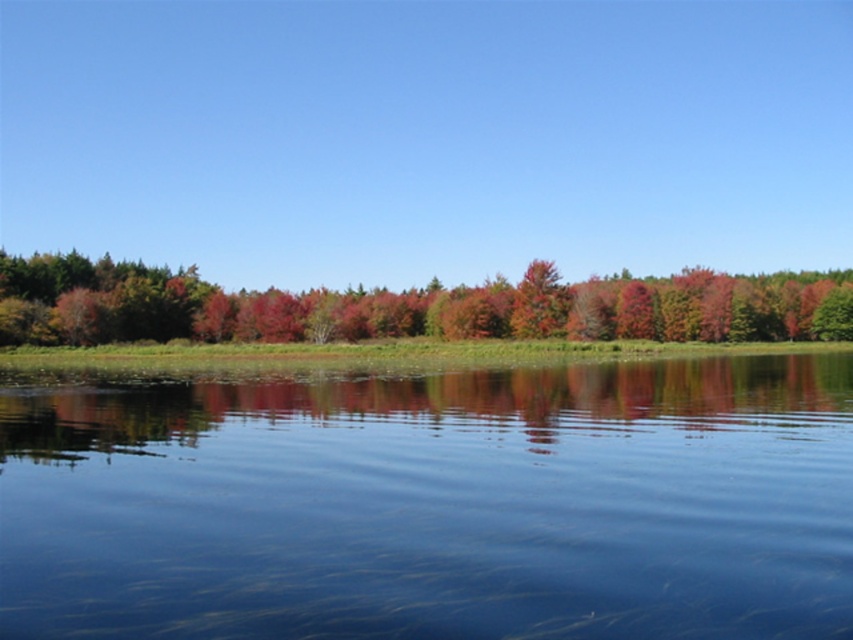
Question: Can you confirm if green matte tree at center is positioned above shiny red tree at center?

Choices:
 (A) yes
 (B) no

Answer: (B)

Question: Which object appears closest to the camera in this image?

Choices:
 (A) transparent water at center
 (B) shiny red tree at center

Answer: (A)

Question: Is transparent water at center thinner than shiny red tree at center?

Choices:
 (A) yes
 (B) no

Answer: (B)

Question: Which object is positioned closest to the green matte tree at center?

Choices:
 (A) shiny red tree at center
 (B) transparent water at center

Answer: (A)

Question: Which object is closer to the camera taking this photo?

Choices:
 (A) green matte tree at center
 (B) transparent water at center
 (C) shiny red tree at center

Answer: (B)

Question: Is the position of transparent water at center less distant than that of green matte tree at center?

Choices:
 (A) yes
 (B) no

Answer: (A)